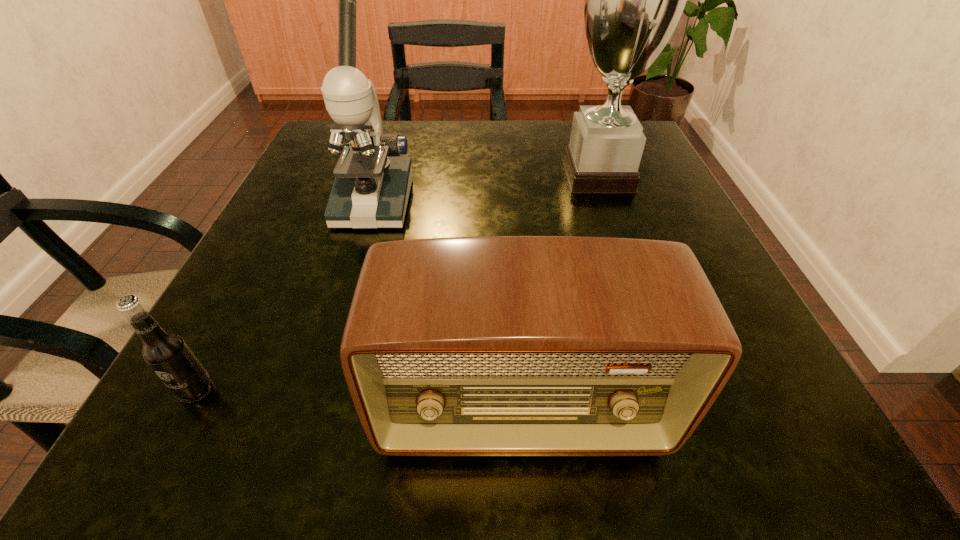
Image resolution: width=960 pixels, height=540 pixels. Identify the location of object present at the far edge. (633, 0).

This screenshot has height=540, width=960. I want to click on radio receiver at the near edge, so click(493, 345).

This screenshot has width=960, height=540. I want to click on root beer present at the near edge, so click(168, 355).

Locate an element on the screen. microscope that is at the left edge is located at coordinates (371, 190).

This screenshot has width=960, height=540. Find the location of `root beer that is at the left edge`. root beer that is at the left edge is located at coordinates (168, 355).

Find the location of `object at the right edge`. object at the right edge is located at coordinates (633, 0).

What are the coordinates of `object situated at the near left corner` in the screenshot? It's located at (168, 355).

Where is `object that is at the far right corner`? object that is at the far right corner is located at coordinates (633, 0).

Where is `blank space at the far edge of the desktop`? blank space at the far edge of the desktop is located at coordinates (428, 123).

The height and width of the screenshot is (540, 960). What are the coordinates of `vacant region at the near edge` in the screenshot? It's located at (337, 449).